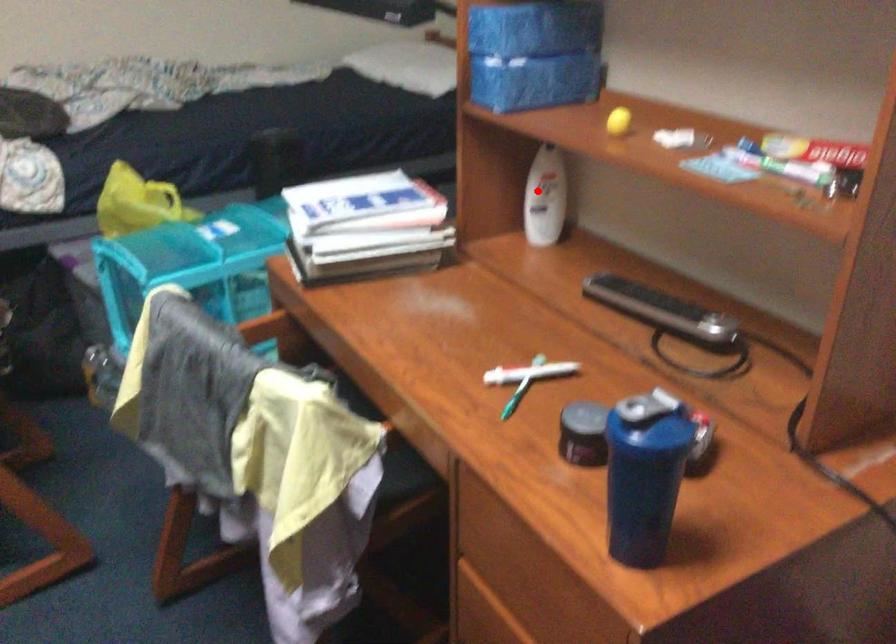
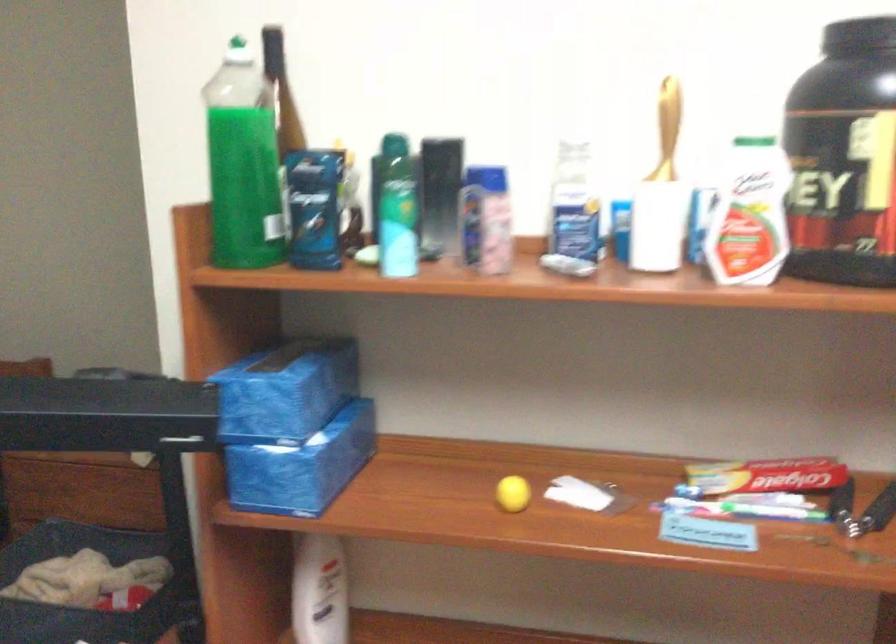
Question: I am providing you with two images of the same scene from different viewpoints. In image1, a red point is highlighted. Considering the same 3D point in image2, which of the following is correct?

Choices:
 (A) It is closer
 (B) It is farther

Answer: (A)